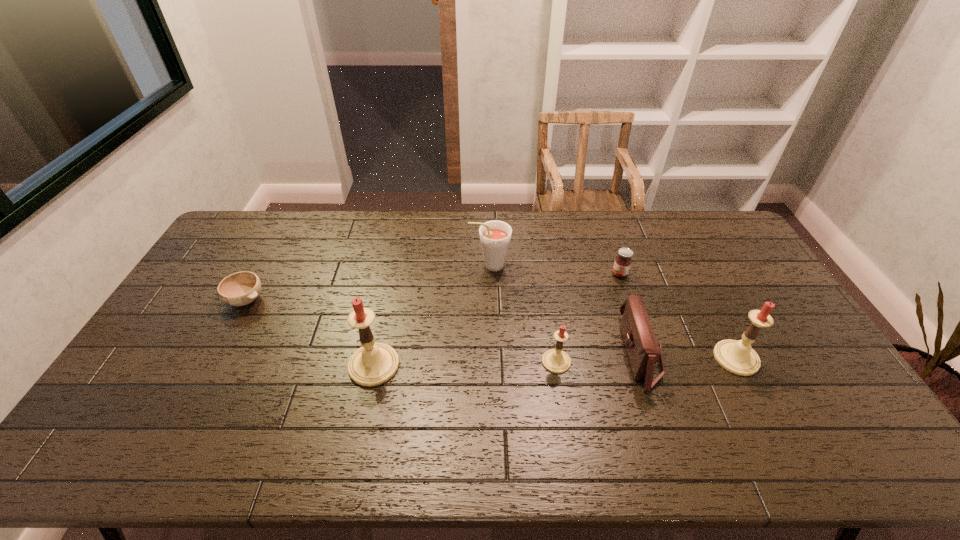
In order to click on the third closest candle to the shoulder bag in this screenshot , I will do `click(373, 364)`.

Identify which candle is located as the second nearest to the second object from left to right. Please provide its 2D coordinates. Your answer should be formatted as a tuple, i.e. [(x, y)], where the tuple contains the x and y coordinates of a point satisfying the conditions above.

[(738, 357)]

The image size is (960, 540). I want to click on free spot that satisfies the following two spatial constraints: 1. on the label side of the jam; 2. on the left side of the rightmost candle, so click(x=648, y=358).

Find the location of `vacant position in the image that satisfies the following two spatial constraints: 1. on the back side of the rightmost object; 2. on the drink side of the root beer`. vacant position in the image that satisfies the following two spatial constraints: 1. on the back side of the rightmost object; 2. on the drink side of the root beer is located at coordinates (687, 265).

Identify the location of free space in the image that satisfies the following two spatial constraints: 1. on the front flap of the shoulder bag; 2. on the front side of the leftmost candle. (644, 365).

Locate an element on the screen. vacant area that satisfies the following two spatial constraints: 1. on the drink side of the root beer; 2. on the left side of the rightmost candle is located at coordinates (492, 358).

Locate an element on the screen. free location that satisfies the following two spatial constraints: 1. on the back side of the second candle from left to right; 2. on the right side of the rightmost candle is located at coordinates (556, 358).